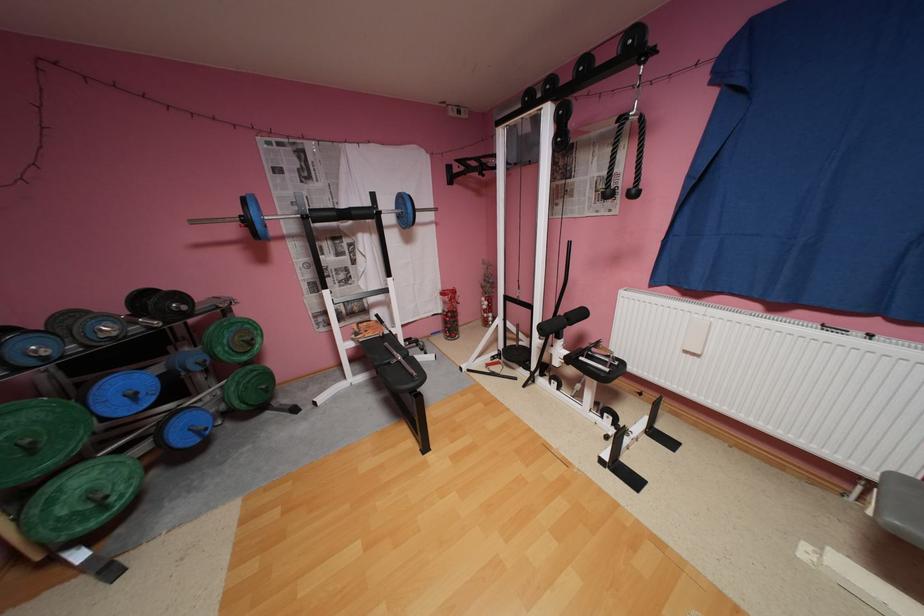
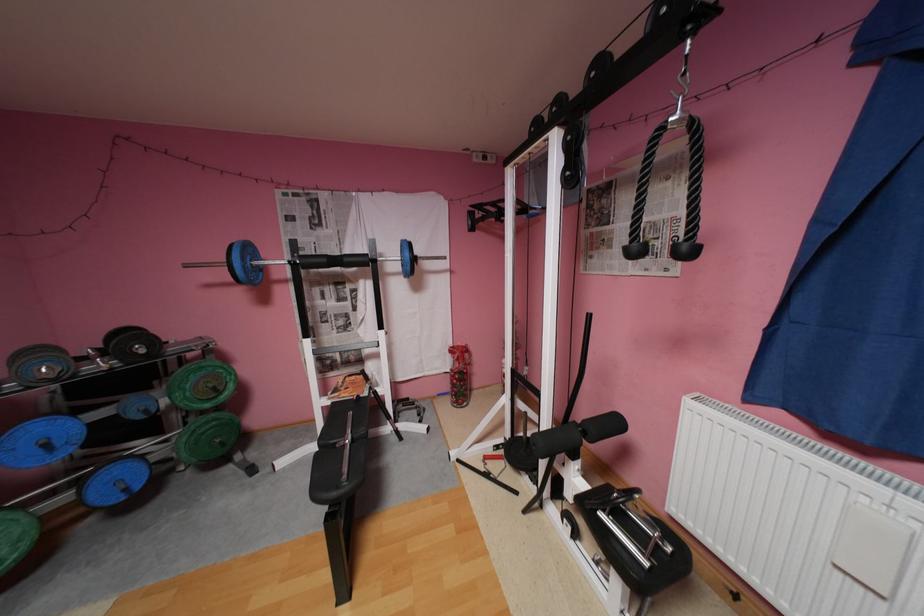
In the second image, find the point that corresponds to (x=80, y=315) in the first image.

(49, 351)